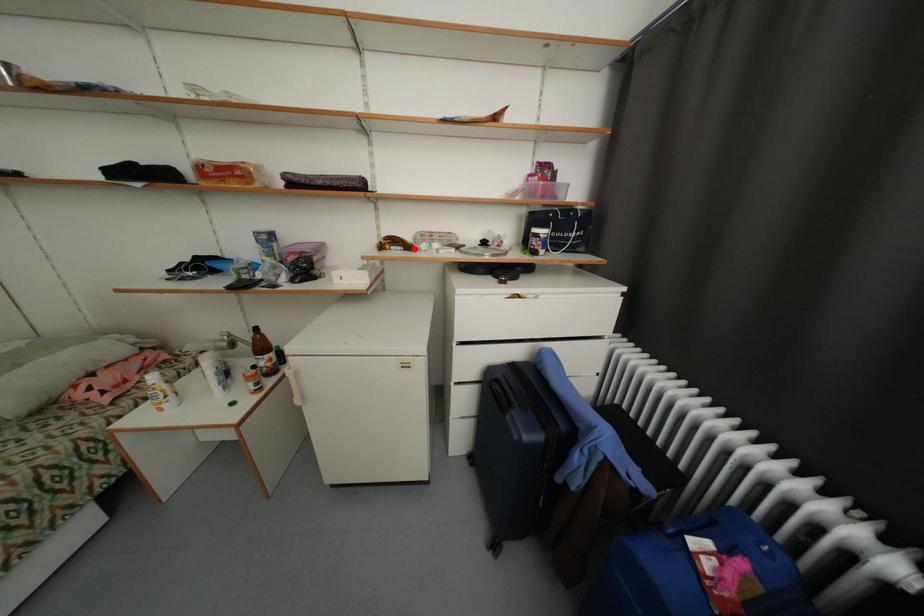
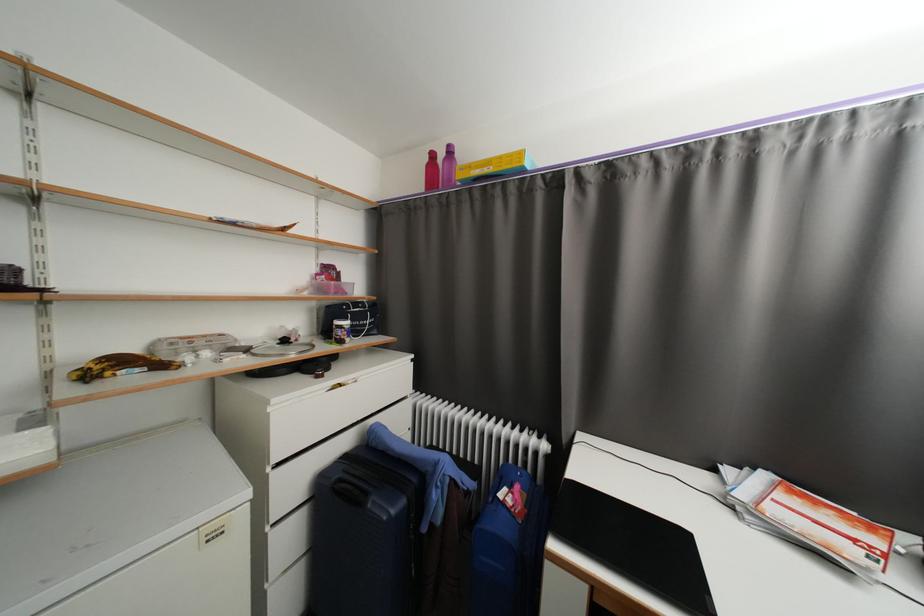
In the second image, find the point that corresponds to the highlighted location in the first image.

(167, 367)